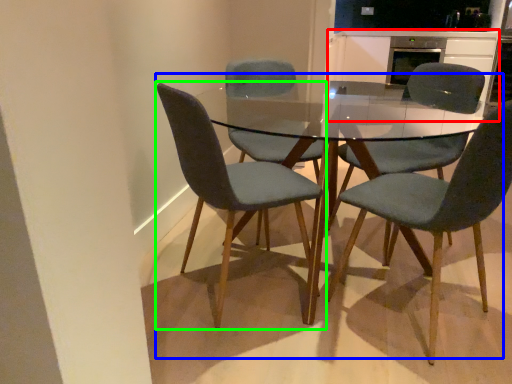
Question: Based on their relative distances, which object is farther from cabinetry (highlighted by a red box)? Choose from kitchen & dining room table (highlighted by a blue box) and chair (highlighted by a green box).

Choices:
 (A) kitchen & dining room table
 (B) chair

Answer: (B)